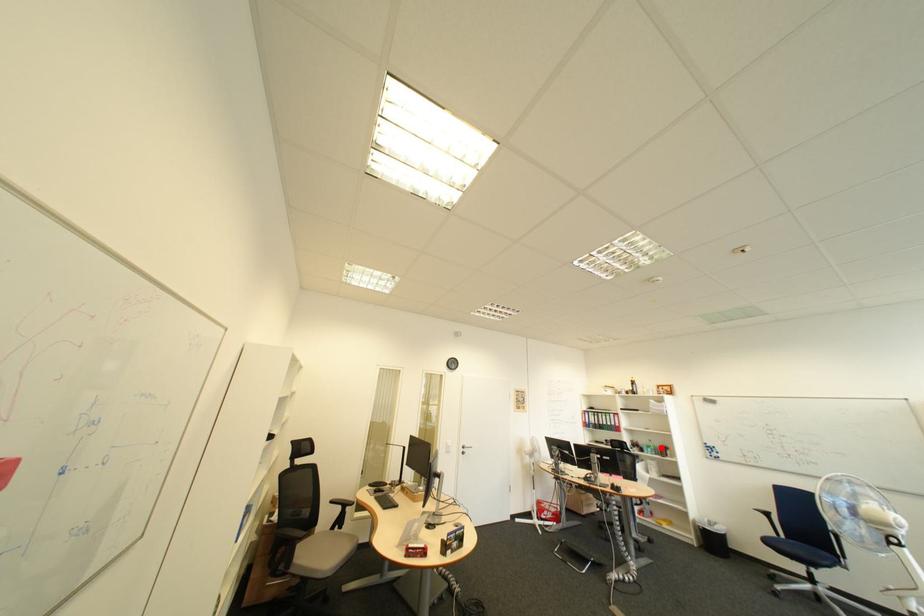
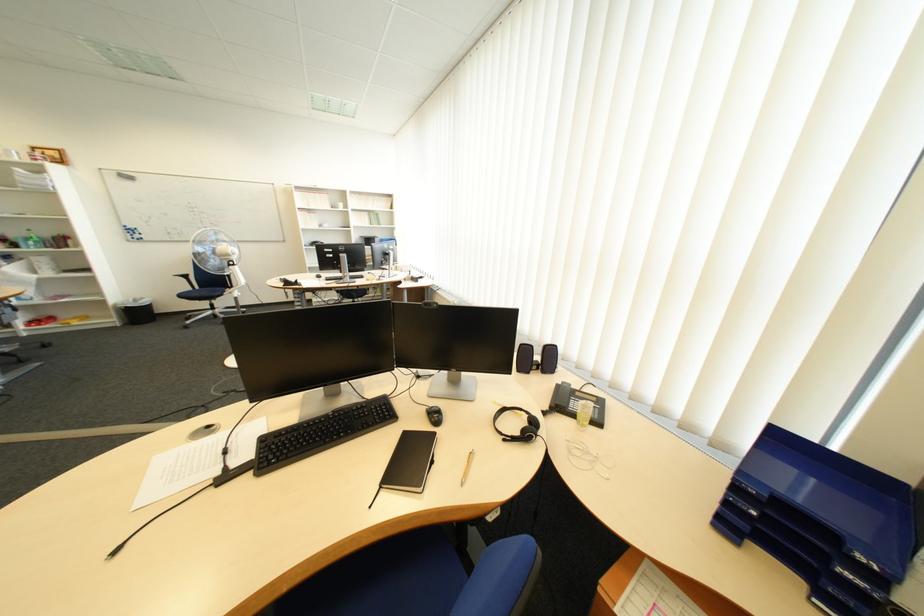
Find the pixel in the second image that matches the highlighted location in the first image.

(41, 240)